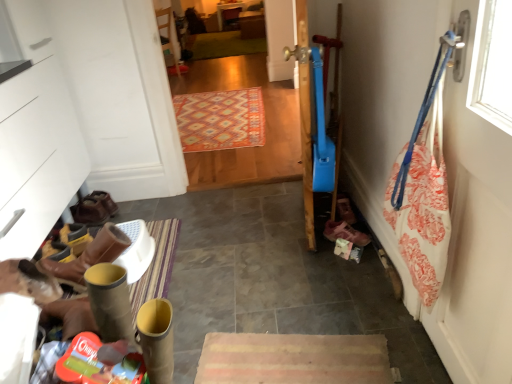
Where is `free space between brown leather boots at lower left, positioned as the second footwear in back-to-front order, and pink fabric shoe at lower right, which is the 1th footwear in front-to-back order`? This screenshot has width=512, height=384. free space between brown leather boots at lower left, positioned as the second footwear in back-to-front order, and pink fabric shoe at lower right, which is the 1th footwear in front-to-back order is located at coordinates (221, 233).